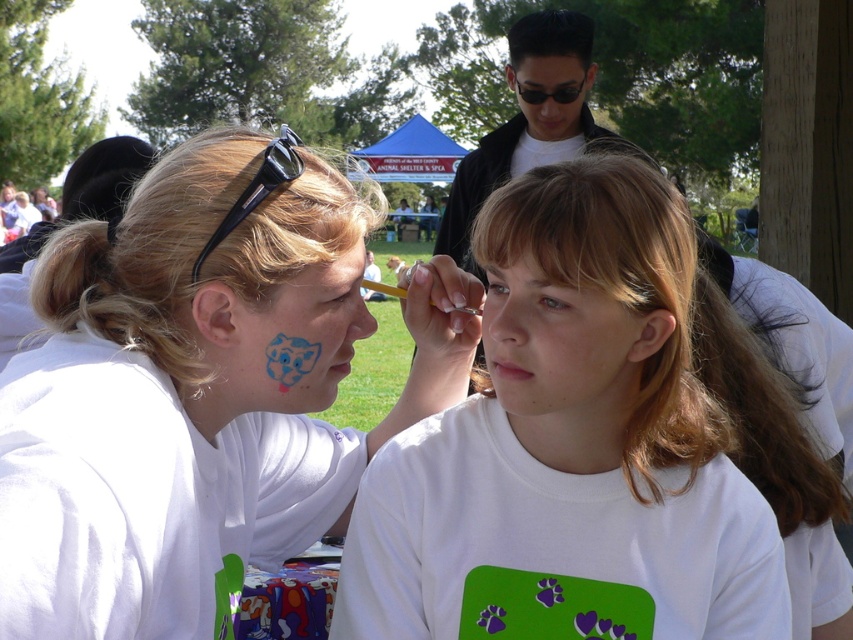
You are an artist at a community event and need to ensure your supplies are arranged properly. You have the blue matte face paint at left and the black plastic sunglasses at upper left. Which object is shorter in height?

The blue matte face paint at left has a lesser height compared to the black plastic sunglasses at upper left, so the blue matte face paint at left is shorter in height.

You are an artist at a community event. You have to paint a design on the matte black forehead at upper center and the black plastic goggles at upper center. Which object should you paint first if you want to start with the taller one?

The matte black forehead at upper center is much taller than the black plastic goggles at upper center, so you should paint the matte black forehead at upper center first.

You are standing in the middle of the scene and want to move towards the two points. Which point, point (531, 308) or point (300, 157), will you reach first?

You will reach point (531, 308) first because it is closer to you than point (300, 157).